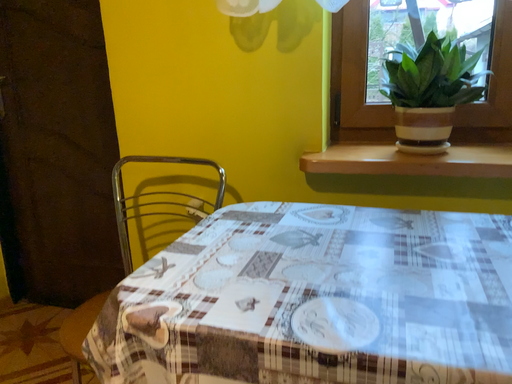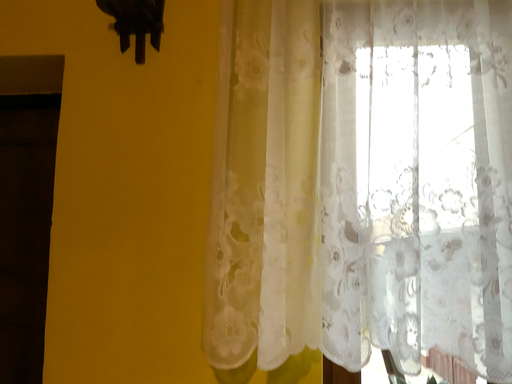
Question: How did the camera likely rotate when shooting the video?

Choices:
 (A) rotated upward
 (B) rotated downward

Answer: (A)